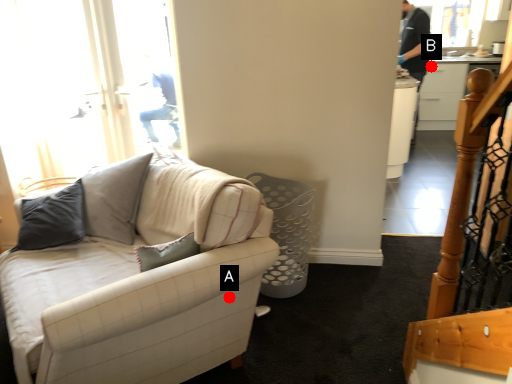
Question: Two points are circled on the image, labeled by A and B beside each circle. Among these points, which one is nearest to the camera?

Choices:
 (A) A is closer
 (B) B is closer

Answer: (A)